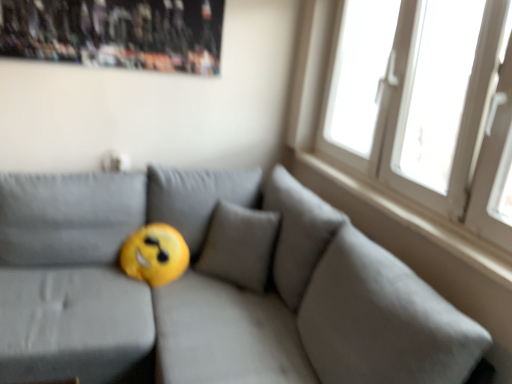
Question: Can you confirm if wooden poster at upper left is shorter than white plastic window at upper right?

Choices:
 (A) yes
 (B) no

Answer: (A)

Question: Does wooden poster at upper left appear on the left side of white plastic window at upper right?

Choices:
 (A) no
 (B) yes

Answer: (B)

Question: Is wooden poster at upper left positioned in front of white plastic window at upper right?

Choices:
 (A) no
 (B) yes

Answer: (A)

Question: Considering the relative sizes of wooden poster at upper left and white plastic window at upper right in the image provided, is wooden poster at upper left wider than white plastic window at upper right?

Choices:
 (A) yes
 (B) no

Answer: (B)

Question: Is wooden poster at upper left facing towards white plastic window at upper right?

Choices:
 (A) no
 (B) yes

Answer: (A)

Question: Which is correct: wooden poster at upper left is inside white smooth window sill at upper right, or outside of it?

Choices:
 (A) outside
 (B) inside

Answer: (A)

Question: Looking at their shapes, would you say wooden poster at upper left is wider or thinner than white smooth window sill at upper right?

Choices:
 (A) wide
 (B) thin

Answer: (B)

Question: Is wooden poster at upper left taller or shorter than white smooth window sill at upper right?

Choices:
 (A) tall
 (B) short

Answer: (A)

Question: From a real-world perspective, is wooden poster at upper left positioned above or below white smooth window sill at upper right?

Choices:
 (A) below
 (B) above

Answer: (B)

Question: From a real-world perspective, is white plastic window at upper right physically located above or below wooden poster at upper left?

Choices:
 (A) below
 (B) above

Answer: (A)

Question: From the image's perspective, relative to wooden poster at upper left, is white plastic window at upper right above or below?

Choices:
 (A) above
 (B) below

Answer: (B)

Question: Is white plastic window at upper right to the left or to the right of wooden poster at upper left in the image?

Choices:
 (A) right
 (B) left

Answer: (A)

Question: Considering the positions of point (439, 193) and point (158, 29), is point (439, 193) closer or farther from the camera than point (158, 29)?

Choices:
 (A) closer
 (B) farther

Answer: (A)

Question: Is white smooth window sill at upper right in front of or behind yellow fabric pillow at center in the image?

Choices:
 (A) front
 (B) behind

Answer: (B)

Question: From the image's perspective, is white smooth window sill at upper right above or below yellow fabric pillow at center?

Choices:
 (A) above
 (B) below

Answer: (A)